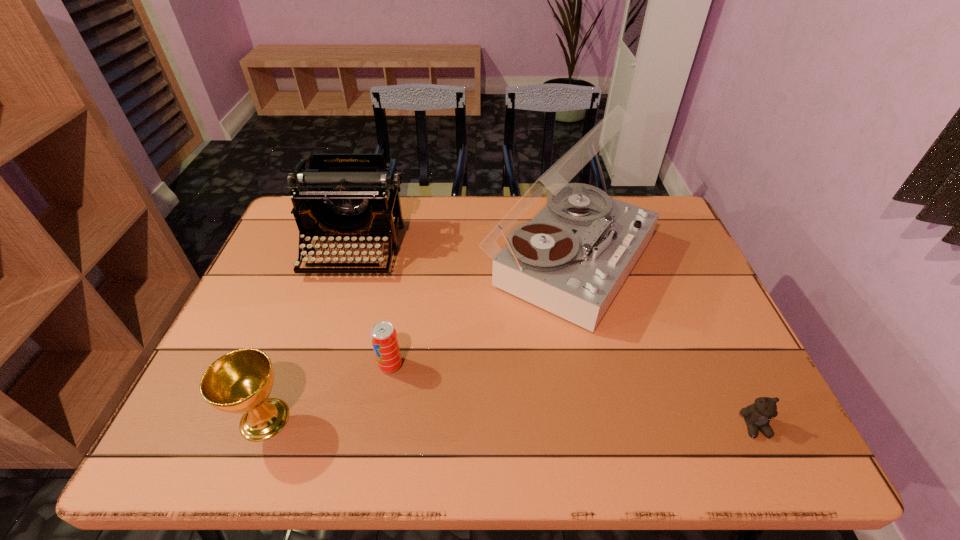
The image size is (960, 540). Identify the location of the tallest object. (572, 258).

This screenshot has width=960, height=540. Find the location of `the second object from right to left`. the second object from right to left is located at coordinates (572, 258).

Identify the location of the second tallest object. (346, 197).

This screenshot has height=540, width=960. Identify the location of the third shortest object. pos(240,381).

Where is `the third farthest object`? the third farthest object is located at coordinates (384, 339).

The image size is (960, 540). I want to click on the second shortest object, so click(384, 339).

This screenshot has height=540, width=960. I want to click on the rightmost object, so click(x=757, y=416).

The height and width of the screenshot is (540, 960). I want to click on teddy bear, so click(x=757, y=416).

This screenshot has height=540, width=960. What are the coordinates of `vacant space located on the front of the tallest object` in the screenshot? It's located at (601, 408).

The height and width of the screenshot is (540, 960). Identify the location of vacant area situated on the typing side of the fourth shortest object. (335, 310).